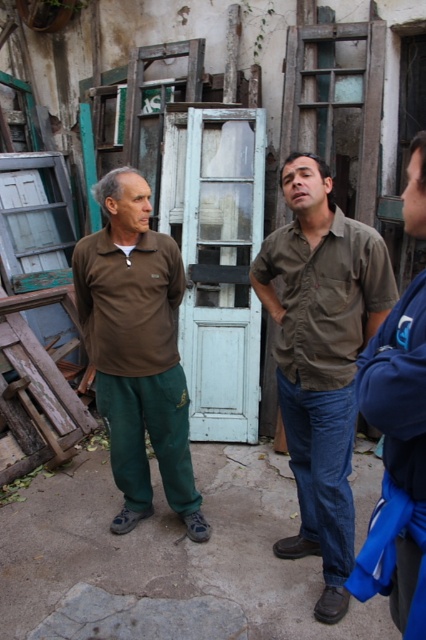
Question: Among these objects, which one is farthest from the camera?

Choices:
 (A) matte brown shirt at left
 (B) blue fleece jacket at right
 (C) matte brown shirt at center
 (D) white wooden door at center

Answer: (D)

Question: Is white wooden door at center bigger than blue fleece jacket at right?

Choices:
 (A) yes
 (B) no

Answer: (A)

Question: Is matte brown shirt at center wider than blue fleece jacket at right?

Choices:
 (A) no
 (B) yes

Answer: (B)

Question: Observing the image, what is the correct spatial positioning of matte brown shirt at center in reference to blue fleece jacket at right?

Choices:
 (A) left
 (B) right

Answer: (A)

Question: Which is farther from the matte brown shirt at center?

Choices:
 (A) blue fleece jacket at right
 (B) white wooden door at center

Answer: (B)

Question: Which object appears farthest from the camera in this image?

Choices:
 (A) white wooden door at center
 (B) blue fleece jacket at right
 (C) matte brown shirt at center
 (D) matte brown shirt at left

Answer: (A)